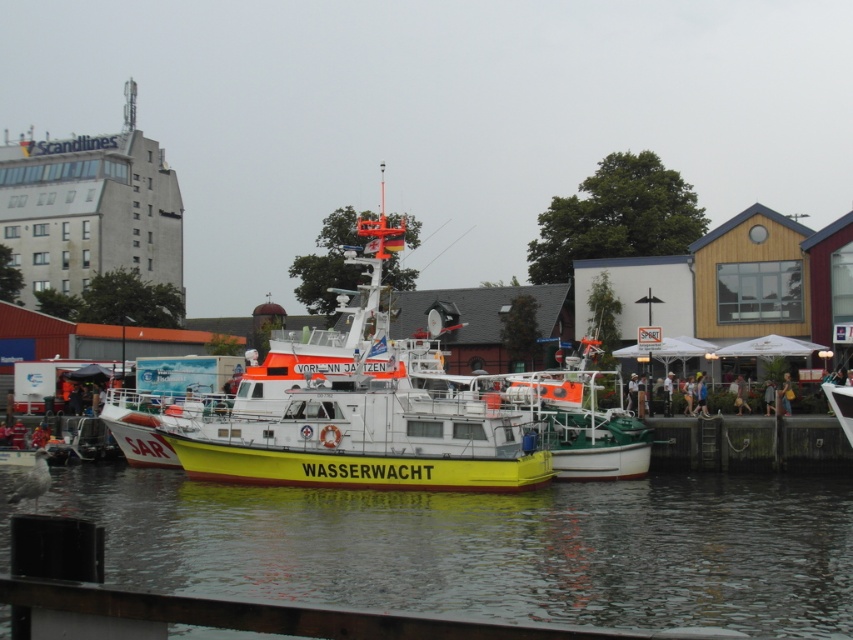
Can you confirm if yellow matte water at center is positioned to the left of yellow matte boat at center?

Incorrect, yellow matte water at center is not on the left side of yellow matte boat at center.

Who is positioned more to the left, yellow matte water at center or yellow matte boat at center?

Positioned to the left is yellow matte boat at center.

Where is `yellow matte water at center`? This screenshot has height=640, width=853. yellow matte water at center is located at coordinates (492, 547).

Find the location of `yellow matte water at center`. yellow matte water at center is located at coordinates (492, 547).